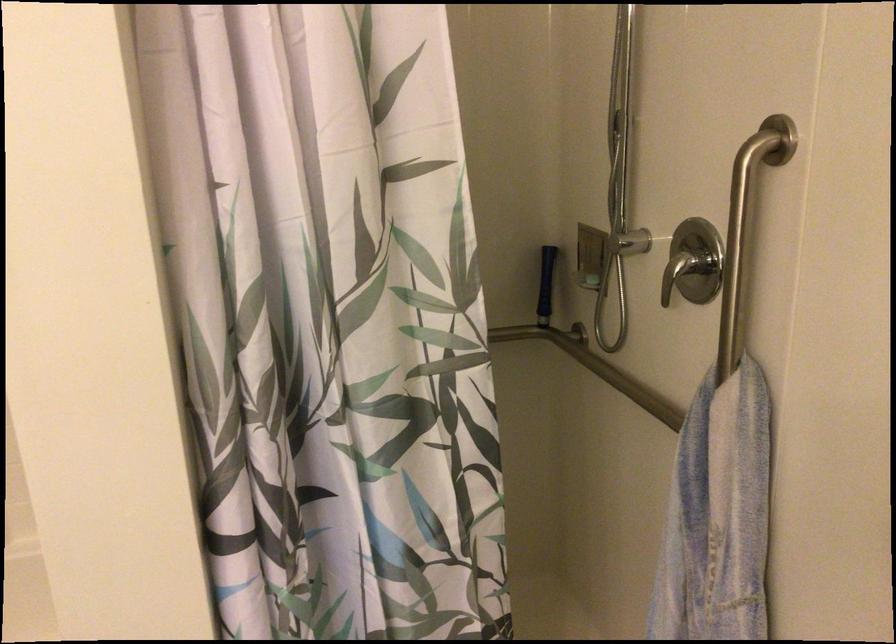
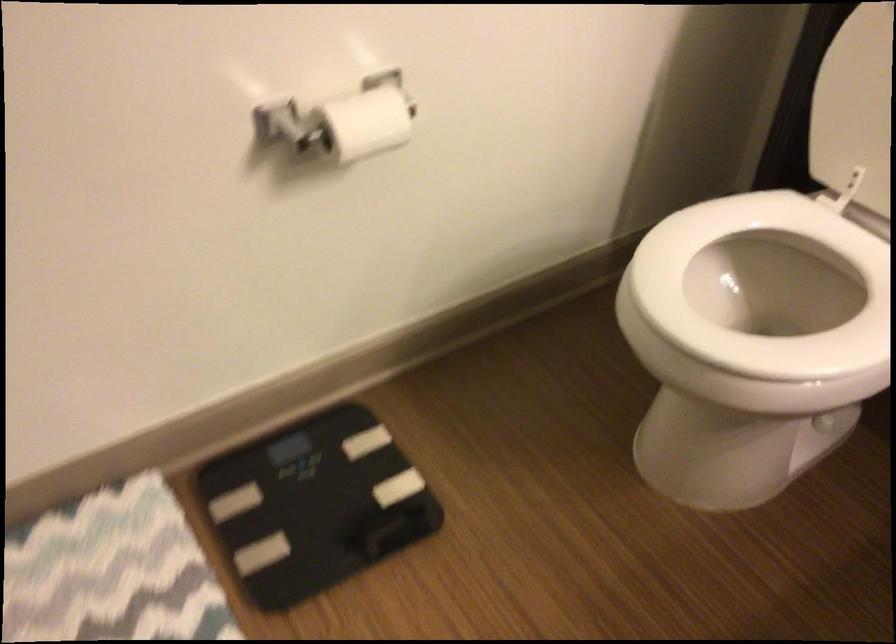
The images are taken continuously from a first-person perspective. In which direction is your viewpoint rotating?

The camera's rotation is toward right-down.